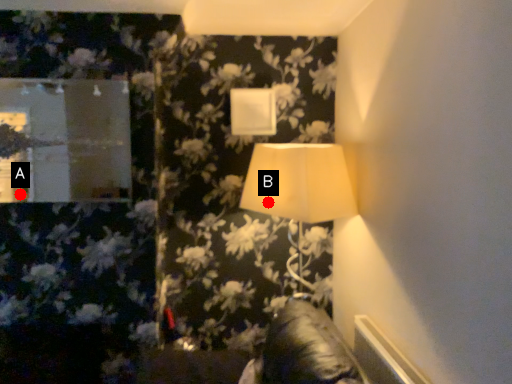
Question: Two points are circled on the image, labeled by A and B beside each circle. Which point is closer to the camera?

Choices:
 (A) A is closer
 (B) B is closer

Answer: (A)